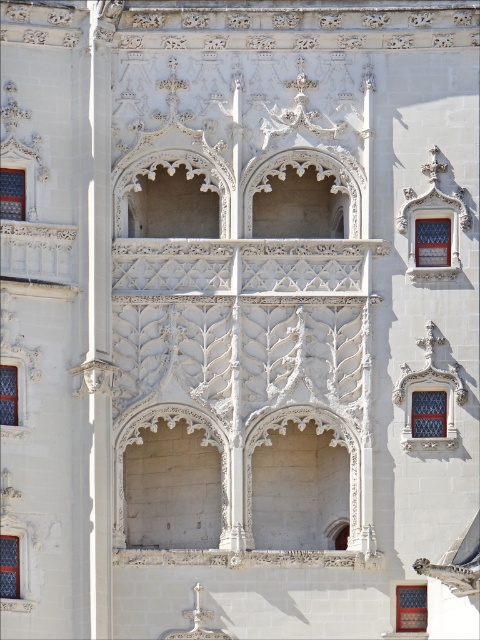
In the scene shown: Does matte glass window at center right lie behind matte glass window at center left?

Yes, matte glass window at center right is behind matte glass window at center left.

Can you confirm if matte glass window at center right is positioned to the left of matte glass window at center left?

No, matte glass window at center right is not to the left of matte glass window at center left.

Where is `matte glass window at center right`? The image size is (480, 640). matte glass window at center right is located at coordinates pos(432,241).

Where is `matte glass window at center right`? This screenshot has height=640, width=480. matte glass window at center right is located at coordinates (432, 241).

Consider the image. Can you confirm if matte glass window at center right is positioned to the left of matte glass window at lower right?

In fact, matte glass window at center right is to the right of matte glass window at lower right.

This screenshot has width=480, height=640. What do you see at coordinates (432, 241) in the screenshot? I see `matte glass window at center right` at bounding box center [432, 241].

Where is `matte glass window at center right`? matte glass window at center right is located at coordinates (432, 241).

Based on the photo, can you confirm if clear glass window at center is positioned to the left of blue glass window at center?

Incorrect, clear glass window at center is not on the left side of blue glass window at center.

Is point (443, 419) less distant than point (4, 573)?

No, it is behind (4, 573).

Measure the distance between clear glass window at center and camera.

clear glass window at center and camera are 83.08 meters apart.

Identify the location of clear glass window at center. (429, 413).